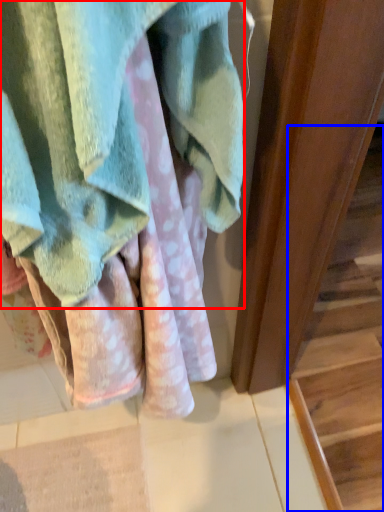
Question: Which object is closer to the camera taking this photo, towel (highlighted by a red box) or stairwell (highlighted by a blue box)?

Choices:
 (A) towel
 (B) stairwell

Answer: (A)